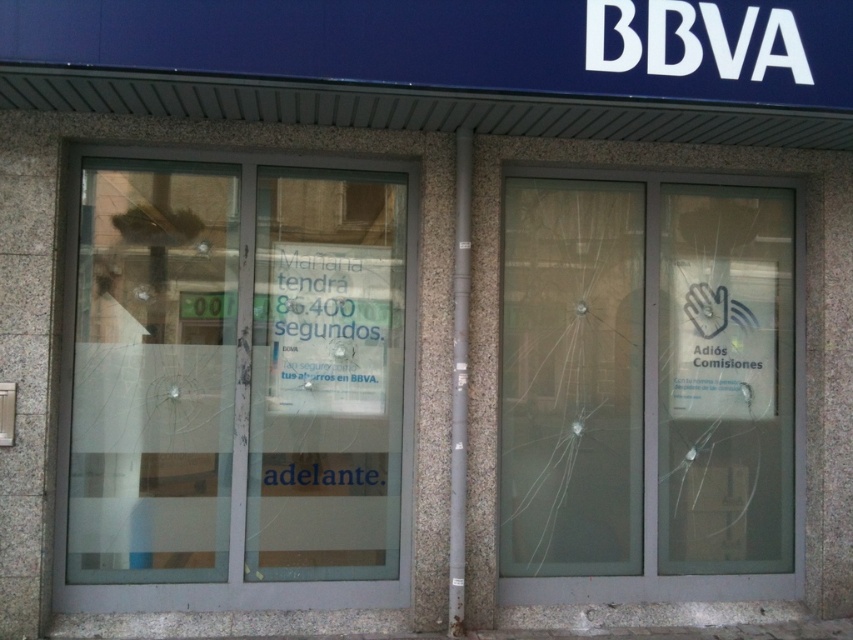
You are standing in front of the BBVA bank branch. You want to enter through the transparent glass door at center. Based on its 2 dimensional location coordinates, which direction should you walk to reach it?

The transparent glass door at center is located at coordinates point (239, 381). Since the Y coordinate is 0.281, which is closer to the bottom of the image, you should walk forward towards the bottom of the image to reach the transparent glass door at center.